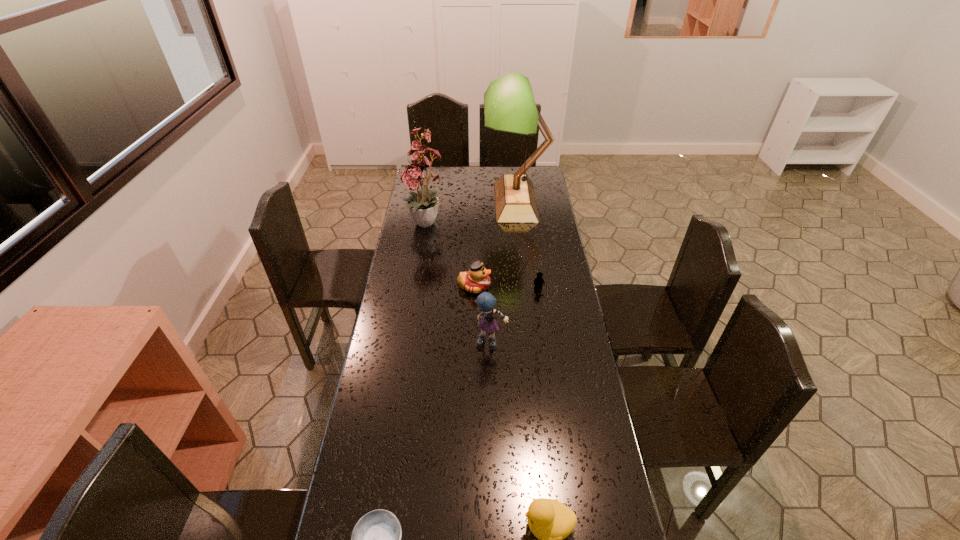
Locate an element on the screen. the tallest object is located at coordinates (509, 106).

Locate an element on the screen. The image size is (960, 540). flower arrangement is located at coordinates (423, 205).

The height and width of the screenshot is (540, 960). Find the location of `rag doll`. rag doll is located at coordinates (486, 302).

Locate an element on the screen. the third tallest object is located at coordinates (486, 302).

Find the location of a particular element. This screenshot has height=540, width=960. the left duck is located at coordinates (476, 280).

The width and height of the screenshot is (960, 540). In order to click on Lego in this screenshot , I will do `click(538, 281)`.

Locate an element on the screen. This screenshot has width=960, height=540. vacant region located 0.160m on the metallic stand of the tallest object is located at coordinates (452, 202).

Where is `free spot located on the metallic stand of the tallest object`? The height and width of the screenshot is (540, 960). free spot located on the metallic stand of the tallest object is located at coordinates (418, 202).

Find the location of a particular element. Image resolution: width=960 pixels, height=540 pixels. vacant space located 0.330m on the metallic stand of the tallest object is located at coordinates (420, 202).

In order to click on free location located 0.160m on the front-facing side of the flower arrangement in this screenshot , I will do `click(420, 269)`.